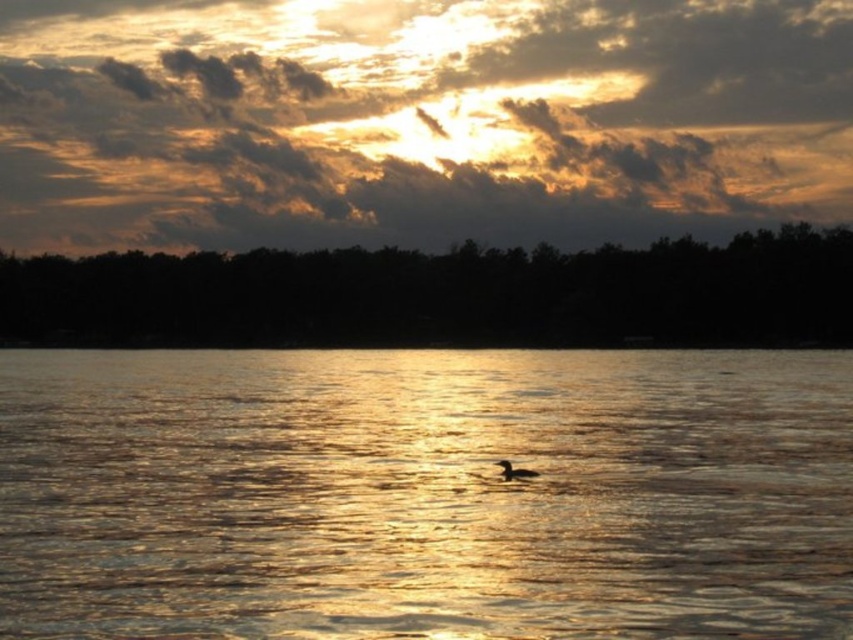
In the scene shown: You are an observer watching the sunset and see the glistening water at center and the brown matte duck at center. Which object takes up more space in the scene?

The glistening water at center is bigger than the brown matte duck at center, so it takes up more space in the scene.

You are standing at the edge of the water in the sunset scene. You see a point marked at coordinates (425, 493). What does this point represent?

The point at coordinates (425, 493) corresponds to glistening water at center, which is reflecting the sunset colors from the sky.

You are a photographer standing at the edge of the water in the scene. You want to capture the golden textured clouds at upper center in your shot. Based on their position, where should you aim your camera? Please provide coordinates as a point in the format of x,y where x and y are between 0 and 1.

The golden textured clouds at upper center are located at position point (416, 120). So you should aim your camera at coordinates (416, 120) to capture them.